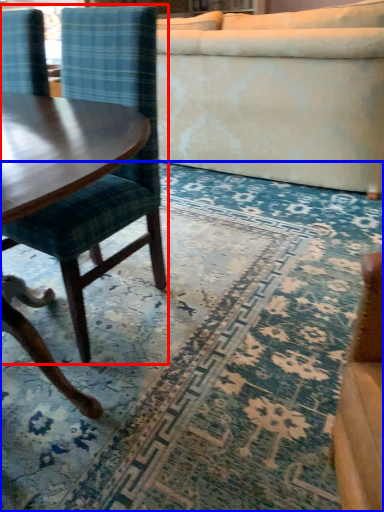
Question: Among these objects, which one is nearest to the camera, chair (highlighted by a red box) or mat (highlighted by a blue box)?

Choices:
 (A) chair
 (B) mat

Answer: (B)